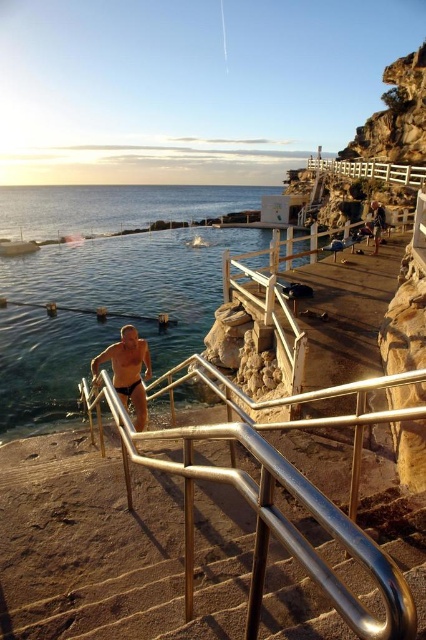
Is silver metallic handrail at center to the right of matte black swim trunks at lower center from the viewer's perspective?

Indeed, silver metallic handrail at center is positioned on the right side of matte black swim trunks at lower center.

In the scene shown: Can you confirm if silver metallic handrail at center is wider than matte black swim trunks at lower center?

Yes, silver metallic handrail at center is wider than matte black swim trunks at lower center.

Is point (365, 401) positioned after point (134, 422)?

No, (365, 401) is closer to viewer.

At what (x,y) coordinates should I click in order to perform the action: click on silver metallic handrail at center. Please return your answer as a coordinate pair (x, y). This screenshot has height=640, width=426. Looking at the image, I should click on (273, 500).

Who is positioned more to the right, matte black swim trunks at lower center or white wooden railing at upper center?

white wooden railing at upper center is more to the right.

Is matte black swim trunks at lower center shorter than white wooden railing at upper center?

Correct, matte black swim trunks at lower center is not as tall as white wooden railing at upper center.

I want to click on matte black swim trunks at lower center, so click(127, 371).

Locate an element on the screen. silver metallic handrail at center is located at coordinates (273, 500).

Is silver metallic handrail at center further to the viewer compared to white wooden railing at upper center?

No.

Does point (325, 496) come farther from viewer compared to point (397, 177)?

That is False.

Locate an element on the screen. The width and height of the screenshot is (426, 640). silver metallic handrail at center is located at coordinates (273, 500).